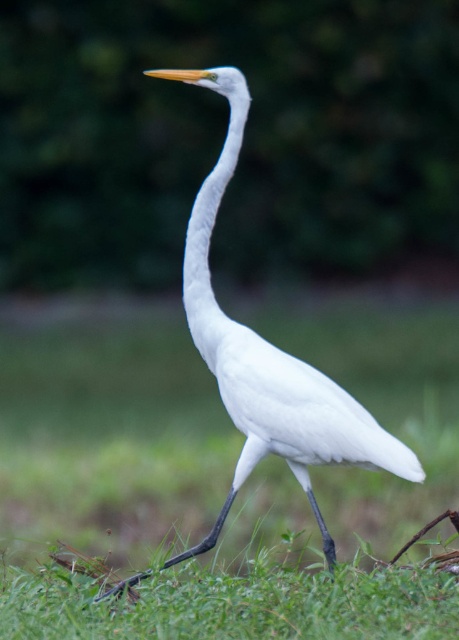
Question: Among these points, which one is nearest to the camera?

Choices:
 (A) (207, 193)
 (B) (341, 436)

Answer: (B)

Question: In this image, where is white matte bird at center located relative to white smooth neck at center?

Choices:
 (A) below
 (B) above

Answer: (A)

Question: Is white matte bird at center positioned behind white smooth neck at center?

Choices:
 (A) no
 (B) yes

Answer: (A)

Question: Can you confirm if white matte bird at center is smaller than white smooth neck at center?

Choices:
 (A) yes
 (B) no

Answer: (B)

Question: Which object appears closest to the camera in this image?

Choices:
 (A) white matte bird at center
 (B) white smooth neck at center

Answer: (A)